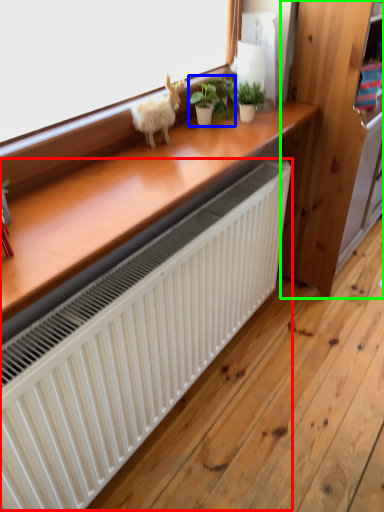
Question: Which is farther away from radiator (highlighted by a red box)? houseplant (highlighted by a blue box) or dresser (highlighted by a green box)?

Choices:
 (A) houseplant
 (B) dresser

Answer: (B)